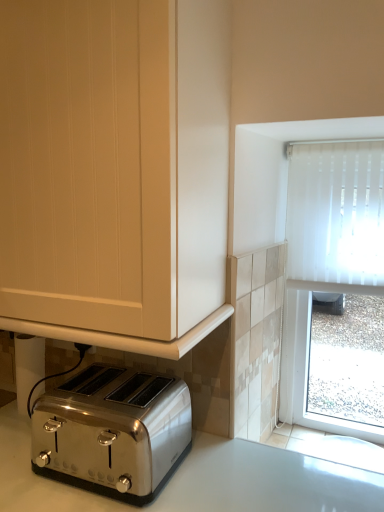
Question: Is satin silver toaster at lower left bigger than matte white cabinet at lower left?

Choices:
 (A) yes
 (B) no

Answer: (B)

Question: Considering the relative sizes of satin silver toaster at lower left and matte white cabinet at lower left in the image provided, is satin silver toaster at lower left taller than matte white cabinet at lower left?

Choices:
 (A) no
 (B) yes

Answer: (A)

Question: Is satin silver toaster at lower left surrounding matte white cabinet at lower left?

Choices:
 (A) no
 (B) yes

Answer: (A)

Question: Would you say satin silver toaster at lower left is outside matte white cabinet at lower left?

Choices:
 (A) no
 (B) yes

Answer: (B)

Question: Does satin silver toaster at lower left have a greater width compared to matte white cabinet at lower left?

Choices:
 (A) no
 (B) yes

Answer: (A)

Question: Is satin silver toaster at lower left positioned before matte white cabinet at lower left?

Choices:
 (A) no
 (B) yes

Answer: (A)

Question: Is matte white cabinet at lower left further to the viewer compared to satin silver toaster at lower left?

Choices:
 (A) no
 (B) yes

Answer: (A)

Question: Can you confirm if matte white cabinet at lower left is positioned to the left of satin silver toaster at lower left?

Choices:
 (A) yes
 (B) no

Answer: (A)

Question: Considering the relative sizes of matte white cabinet at lower left and satin silver toaster at lower left in the image provided, is matte white cabinet at lower left wider than satin silver toaster at lower left?

Choices:
 (A) no
 (B) yes

Answer: (B)

Question: Can you confirm if matte white cabinet at lower left is thinner than satin silver toaster at lower left?

Choices:
 (A) no
 (B) yes

Answer: (A)

Question: From a real-world perspective, is matte white cabinet at lower left located higher than satin silver toaster at lower left?

Choices:
 (A) yes
 (B) no

Answer: (A)

Question: Can you confirm if matte white cabinet at lower left is smaller than satin silver toaster at lower left?

Choices:
 (A) no
 (B) yes

Answer: (A)

Question: Do you think matte white cabinet at lower left is within satin silver toaster at lower left, or outside of it?

Choices:
 (A) outside
 (B) inside

Answer: (A)